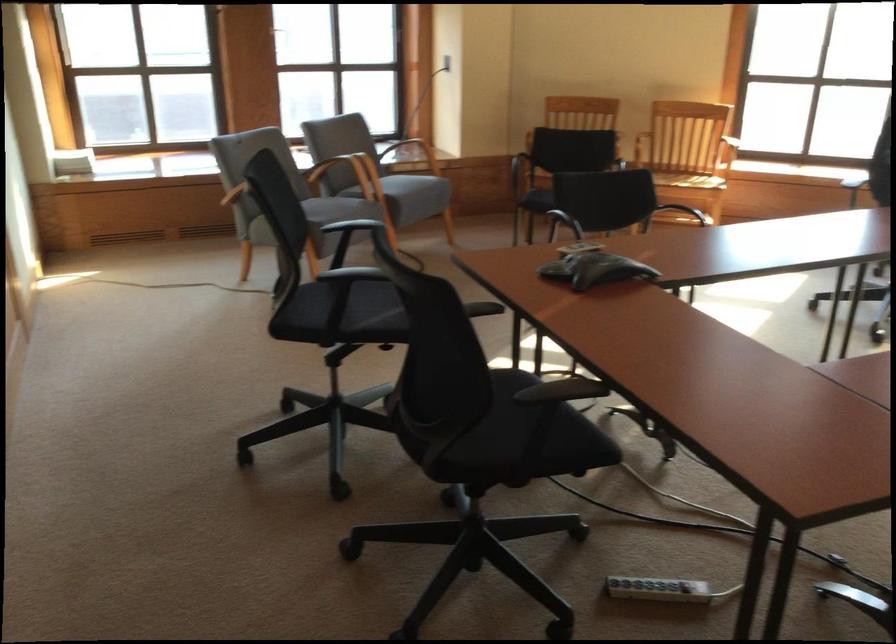
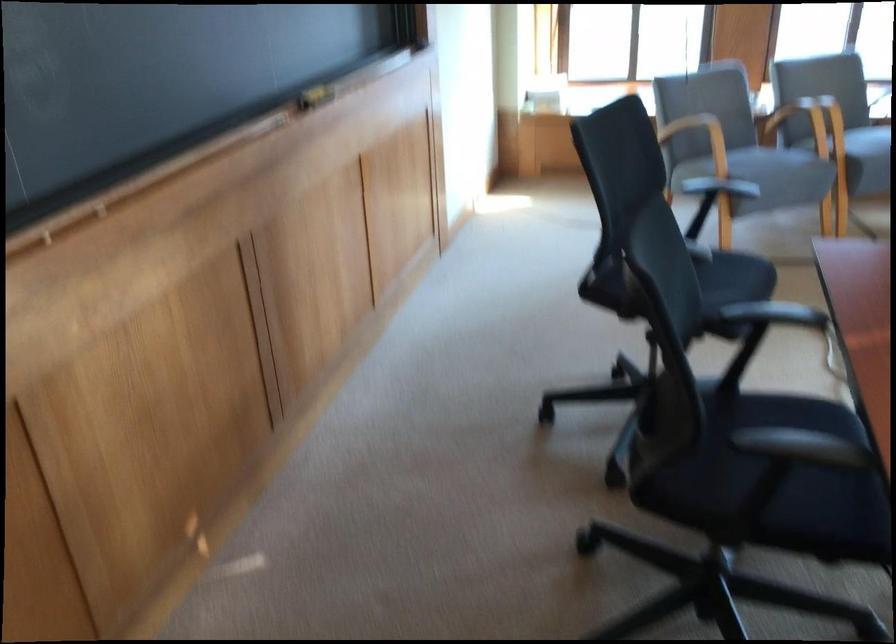
Where in the second image is the point corresponding to the point at 521,413 from the first image?

(789, 477)